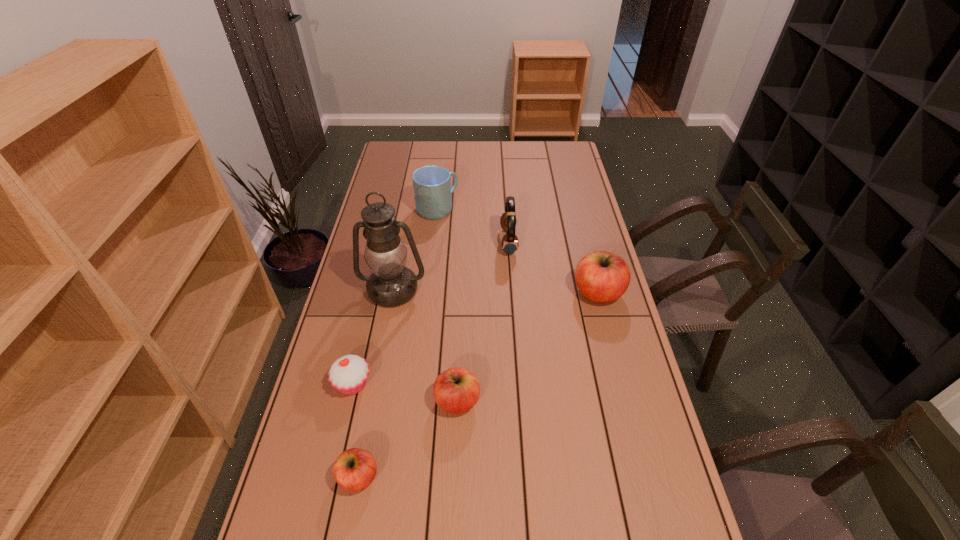
Locate an element on the screen. The width and height of the screenshot is (960, 540). the nearest object is located at coordinates (354, 469).

Locate an element on the screen. The image size is (960, 540). the shortest apple is located at coordinates (354, 469).

I want to click on the second nearest apple, so click(456, 390).

Locate an element on the screen. The height and width of the screenshot is (540, 960). the second tallest apple is located at coordinates (456, 390).

Identify the location of the farthest apple. This screenshot has width=960, height=540. (602, 277).

Where is `the tallest apple`? The image size is (960, 540). the tallest apple is located at coordinates (602, 277).

Identify the location of the farthest object. (432, 184).

Where is `headset`? The height and width of the screenshot is (540, 960). headset is located at coordinates (509, 243).

The width and height of the screenshot is (960, 540). What are the coordinates of `the sixth object from left to right` in the screenshot? It's located at (509, 243).

The height and width of the screenshot is (540, 960). I want to click on the tallest object, so click(x=391, y=284).